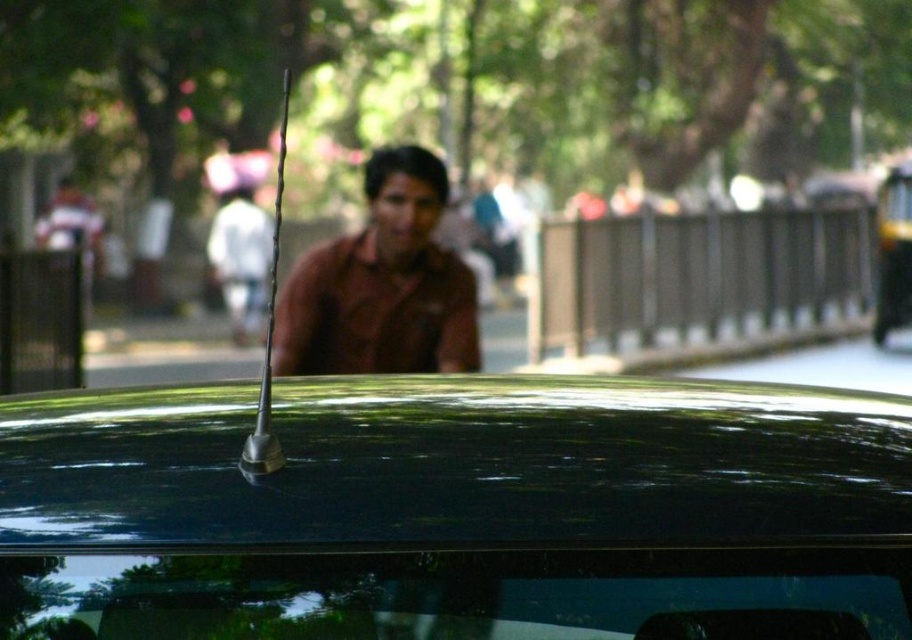
You are standing on the street and see the glossy metallic antenna at center and the brown matte shirt at center. From your perspective, which object is positioned to the right?

The glossy metallic antenna at center is to the right of the brown matte shirt at center.

You are a photographer trying to capture the glossy metallic antenna at center in your photo. The camera is set to focus at point coordinates of 0.795, 0.497. Will the antenna be in focus?

The glossy metallic antenna at center is positioned exactly at point coordinates of [452,508], so yes, it will be in focus.

You are a photographer adjusting your camera settings. You notice the glossy metallic antenna at center and the brown matte shirt at center in your frame. Which object appears shorter in the image?

The glossy metallic antenna at center appears shorter than the brown matte shirt at center because the description states it is not as tall.